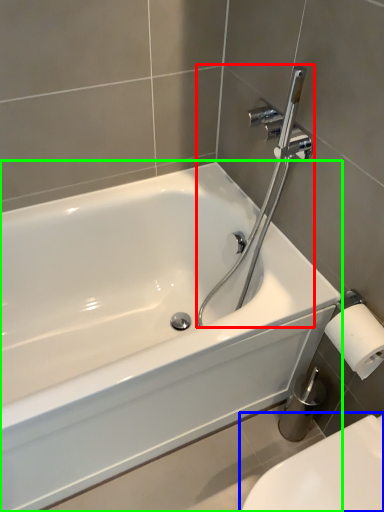
Question: Considering the real-world distances, which object is farthest from plumbing fixture (highlighted by a red box)? toilet (highlighted by a blue box) or bathtub (highlighted by a green box)?

Choices:
 (A) toilet
 (B) bathtub

Answer: (A)